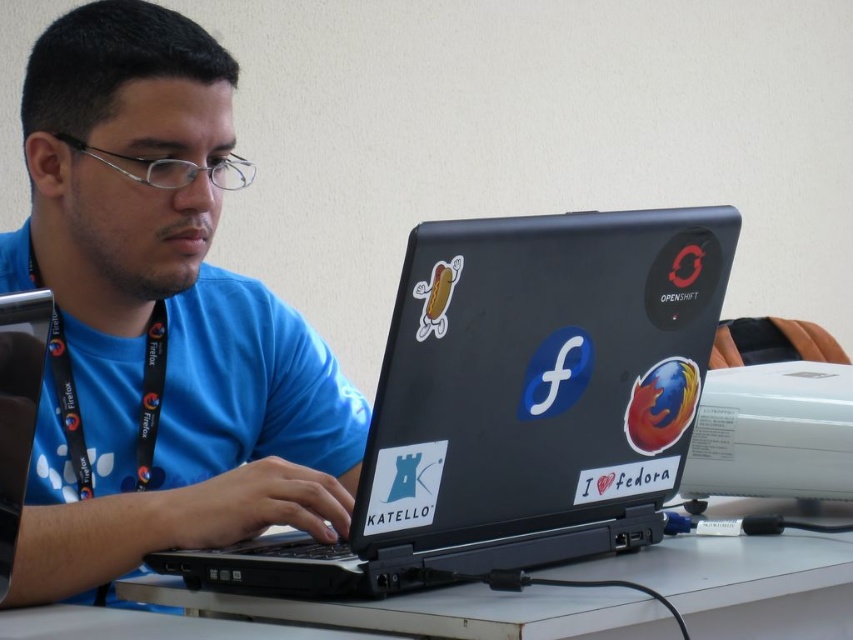
You are standing in front of the table where the person is working. There are two points marked on the table surface at coordinates point (x=366, y=432) and point (x=80, y=436). If you were to place a small object at each point, which point would appear closer to you when looking at the table?

Point (x=366, y=432) is further to the viewer than point (x=80, y=436), so the object placed at point (x=366, y=432) would appear closer to you.

You are a photographer taking a picture of the person sitting at the table. You need to ensure both the blue fabric shirt at center and the black fabric lanyard at left are clearly visible in the photo. Based on their positions, which object will appear larger in the photo?

The blue fabric shirt at center will appear larger in the photo because it is much taller than the black fabric lanyard at left.

You are an assistant helping someone choose an outfit. They want to know which item is bigger between the blue fabric shirt at center and the white plastic table at center. What do you tell them?

The blue fabric shirt at center is larger in size than the white plastic table at center.